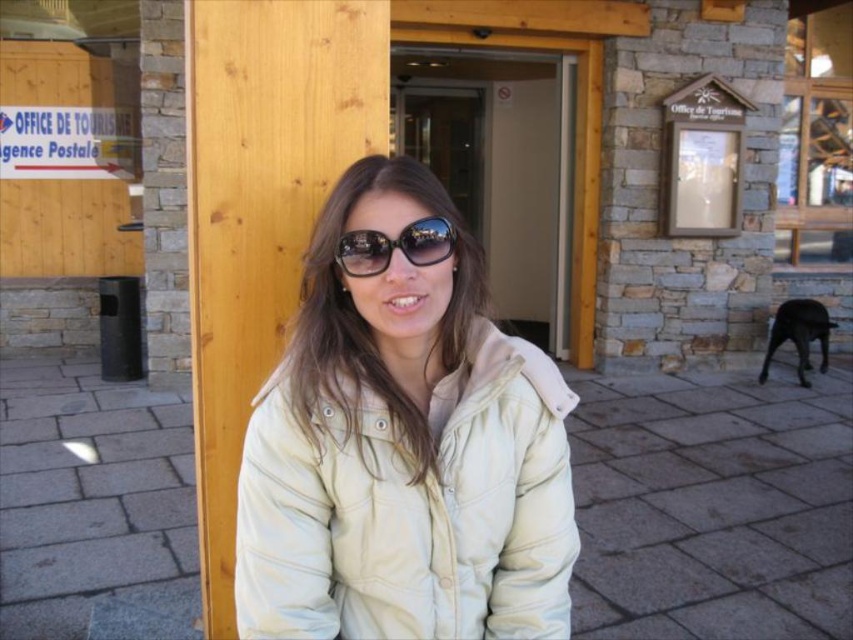
Question: Considering the relative positions of white matte jacket at center and black reflective sunglasses at center in the image provided, where is white matte jacket at center located with respect to black reflective sunglasses at center?

Choices:
 (A) below
 (B) above

Answer: (A)

Question: Which point appears farthest from the camera in this image?

Choices:
 (A) (421, 525)
 (B) (416, 262)

Answer: (A)

Question: Which of the following is the closest to the observer?

Choices:
 (A) black reflective sunglasses at center
 (B) white matte jacket at center

Answer: (B)

Question: Is white matte jacket at center above black reflective sunglasses at center?

Choices:
 (A) no
 (B) yes

Answer: (A)

Question: Is white matte jacket at center behind black reflective sunglasses at center?

Choices:
 (A) no
 (B) yes

Answer: (A)

Question: Among these objects, which one is farthest from the camera?

Choices:
 (A) black reflective sunglasses at center
 (B) white matte jacket at center

Answer: (A)